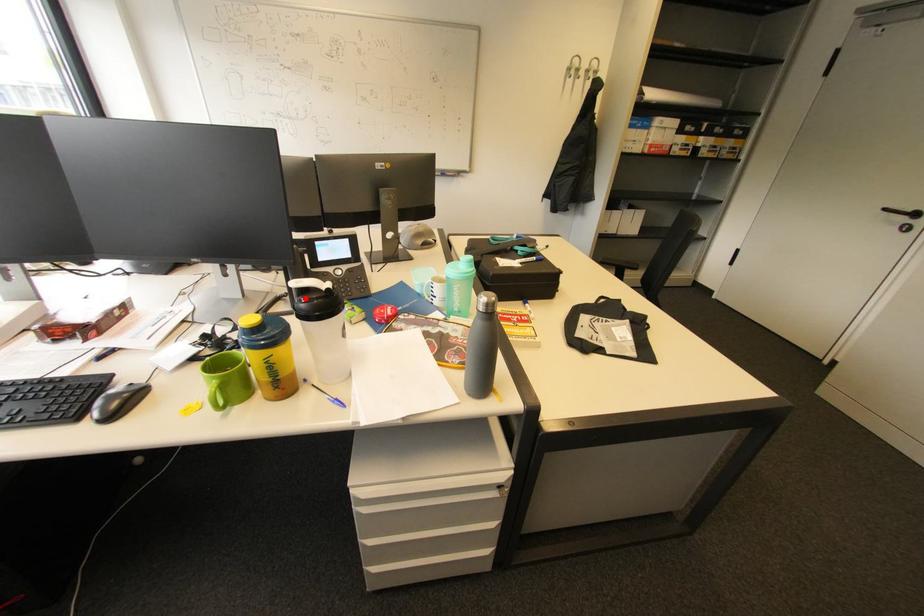
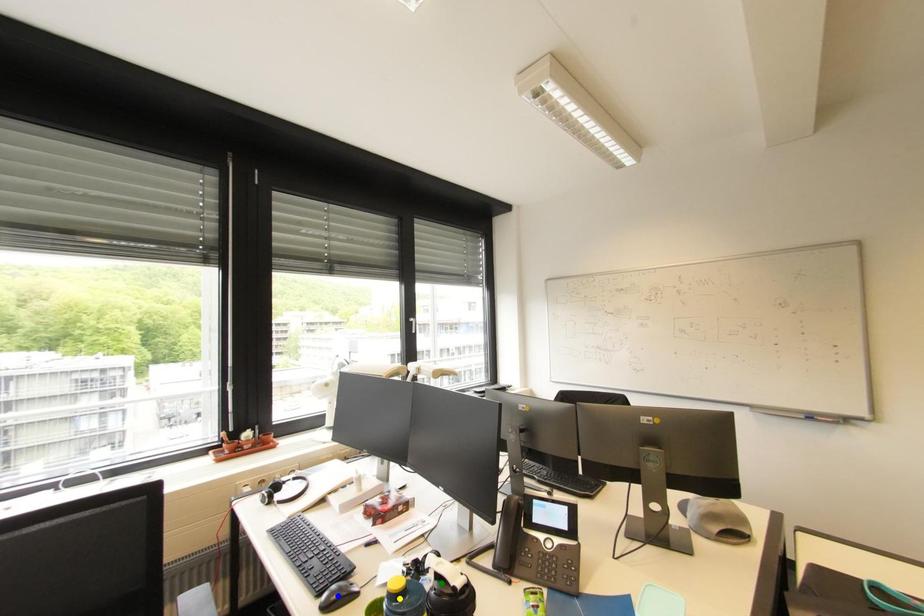
Question: I am providing you with two images of the same scene from different viewpoints. A red point is marked on the first image. You are given multiple points on the second image. Which point in image 2 represents the same 3d spot as the red point in image 1?

Choices:
 (A) yellow point
 (B) green point
 (C) blue point

Answer: (B)